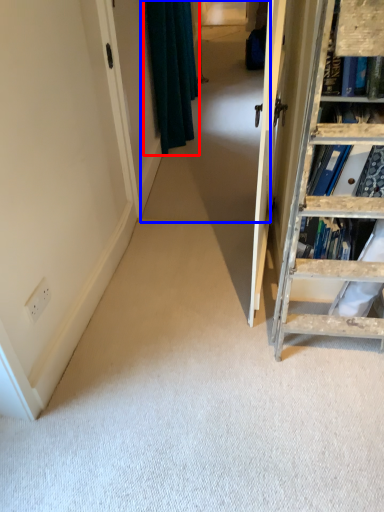
Question: Which object is closer to the camera taking this photo, curtain (highlighted by a red box) or passage (highlighted by a blue box)?

Choices:
 (A) curtain
 (B) passage

Answer: (B)